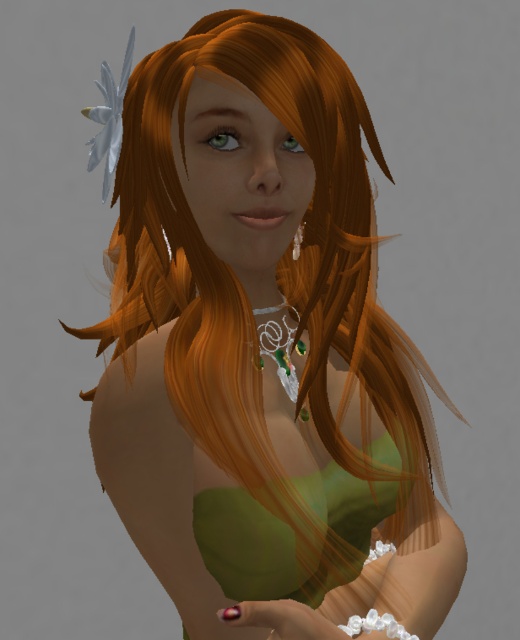
Does point (226, 621) lie in front of point (294, 246)?

Yes, it is.

Can you confirm if shiny pink nail polish at lower center is shorter than green gemstone earring at center?

No, shiny pink nail polish at lower center is not shorter than green gemstone earring at center.

At what (x,y) coordinates should I click in order to perform the action: click on shiny pink nail polish at lower center. Please return your answer as a coordinate pair (x, y). The width and height of the screenshot is (520, 640). Looking at the image, I should click on (281, 620).

Find the location of a particular element. Image resolution: width=520 pixels, height=640 pixels. shiny pink nail polish at lower center is located at coordinates (281, 620).

Is point (202, 490) in front of point (304, 227)?

Yes, point (202, 490) is in front of point (304, 227).

Where is `green matte dress at center`? The image size is (520, 640). green matte dress at center is located at coordinates (289, 536).

Where is `green matte dress at center`? green matte dress at center is located at coordinates (289, 536).

Does green matte dress at center have a smaller size compared to shiny pink nail polish at lower center?

Actually, green matte dress at center might be larger than shiny pink nail polish at lower center.

Find the location of a particular element. The height and width of the screenshot is (640, 520). green matte dress at center is located at coordinates (289, 536).